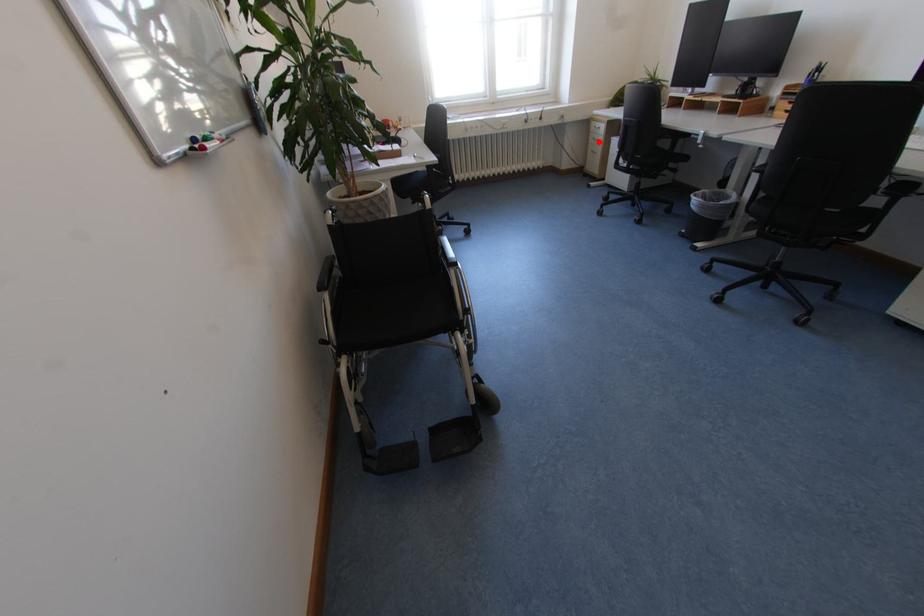
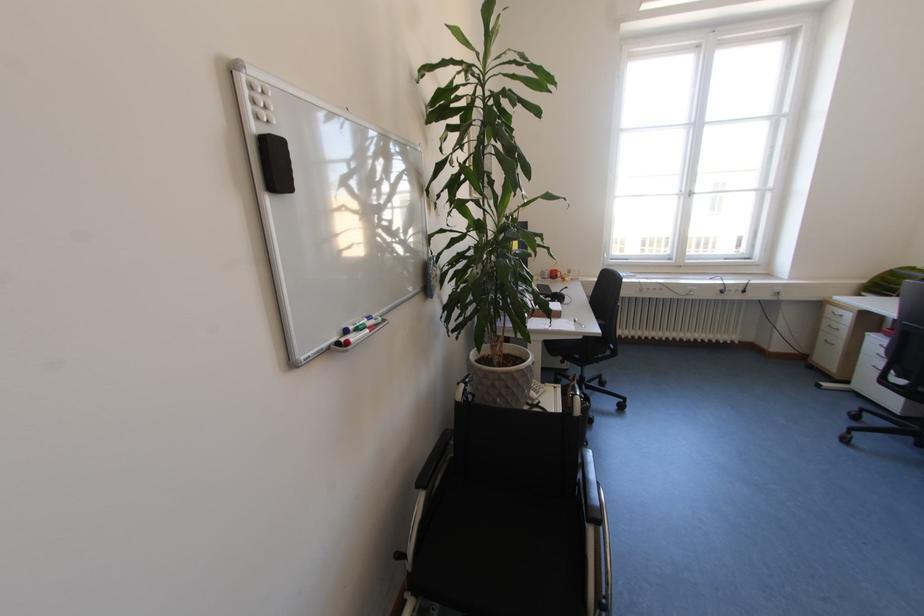
Question: I am providing you with two images of the same scene from different viewpoints. Given a red point in image1, look at the same physical point in image2. Is it:

Choices:
 (A) Closer to the viewpoint
 (B) Farther from the viewpoint

Answer: (B)